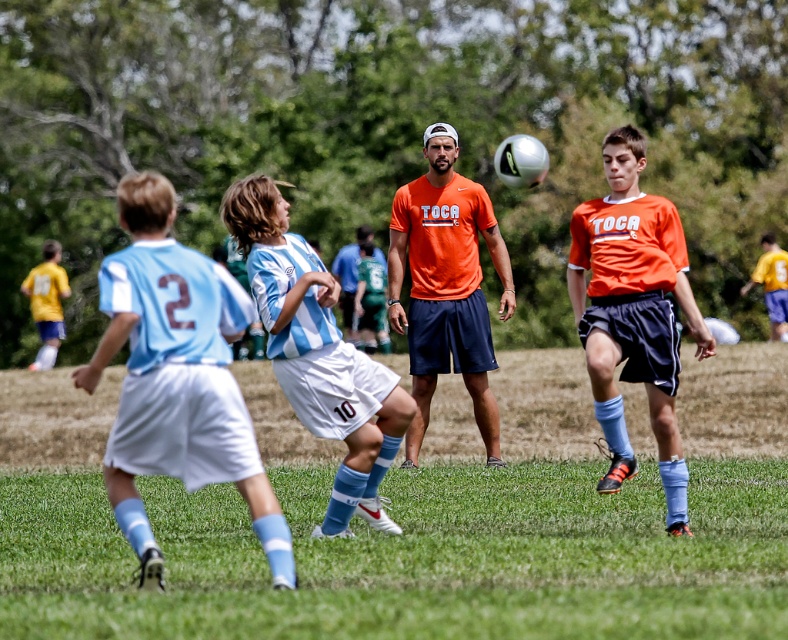
You are a soccer player positioned at the edge of the field. You see the green grass at center and the orange matte shirt at center. How far apart are these two objects from your current position?

The green grass at center is 5.44 meters away from the orange matte shirt at center. Therefore, the distance between the two objects is 5.44 meters.

You are a drone operator trying to capture aerial footage of the soccer match. The soccer ball is midair on the right side of the frame. To ensure the ball stays in the shot, you need to adjust the camera angle so it points towards the ball. Which direction should you tilt the camera relative to the green grass at center?

The soccer ball is positioned slightly towards the right side of the frame, while the green grass at center is located at point (409, 557). To point the camera towards the ball, you should tilt the camera to the right relative to the green grass at center.